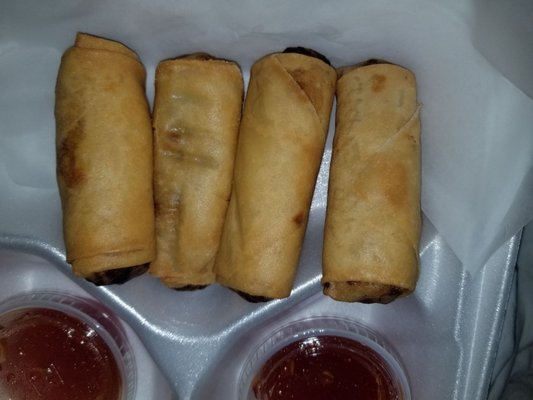
Where is `plastic container`? plastic container is located at coordinates (34, 306).